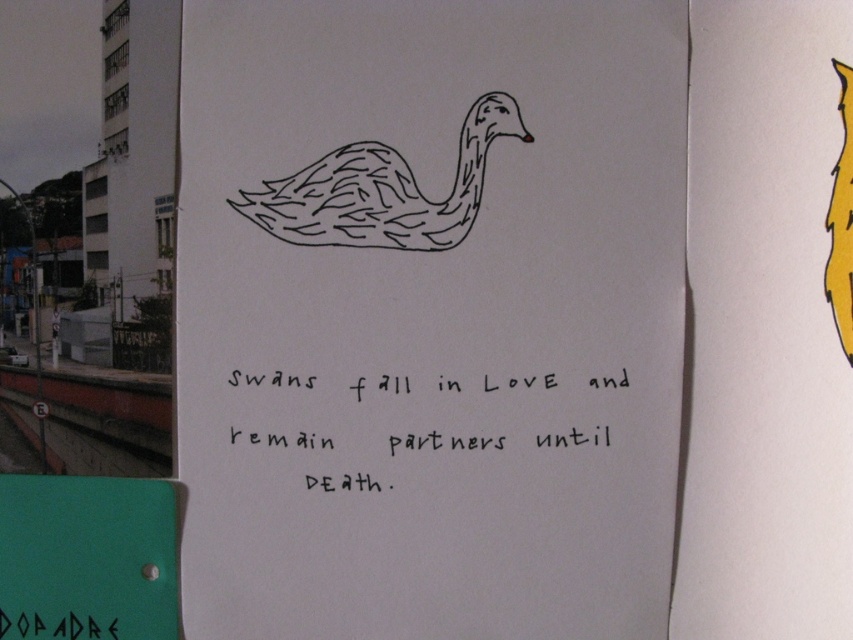
You are holding a camera and want to take a photo of the swan drawing on the paper. The camera is currently 55.81 centimeters away from the point labeled as point [303,438]. Is this distance sufficient to capture the entire swan drawing in the photo?

The point [303,438] is 55.81 centimeters away from the camera. Since the swan drawing is at the top of the paper and the point is likely within its boundaries, this distance should be sufficient to capture the entire swan drawing in the photo.

You are an art student analyzing this paper. You need to determine which object is closer to you. Based on the image, which is closer between the black line drawing swan at center and the yellow matte feather at upper right?

The black line drawing swan at center is closer to you than the yellow matte feather at upper right because it is positioned further to the viewer.

From the picture: You are an art student analyzing the paper. You notice the black line drawing swan at center and the black ink writing at center. Which object has a greater width?

The black ink writing at center is wider than the black line drawing swan at center because the swan is thinner than the writing.